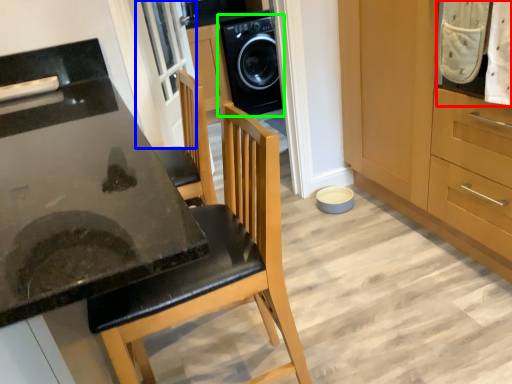
Question: Which object is positioned farthest from laundry (highlighted by a red box)? Select from screen door (highlighted by a blue box) and home appliance (highlighted by a green box).

Choices:
 (A) screen door
 (B) home appliance

Answer: (B)